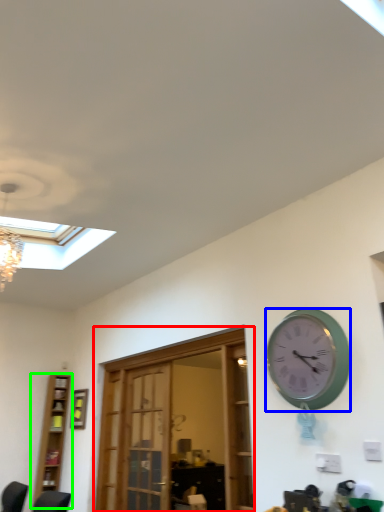
Question: Which object is the closest to the door (highlighted by a red box)? Choose among these: wall clock (highlighted by a blue box) or bookshelf (highlighted by a green box).

Choices:
 (A) wall clock
 (B) bookshelf

Answer: (A)